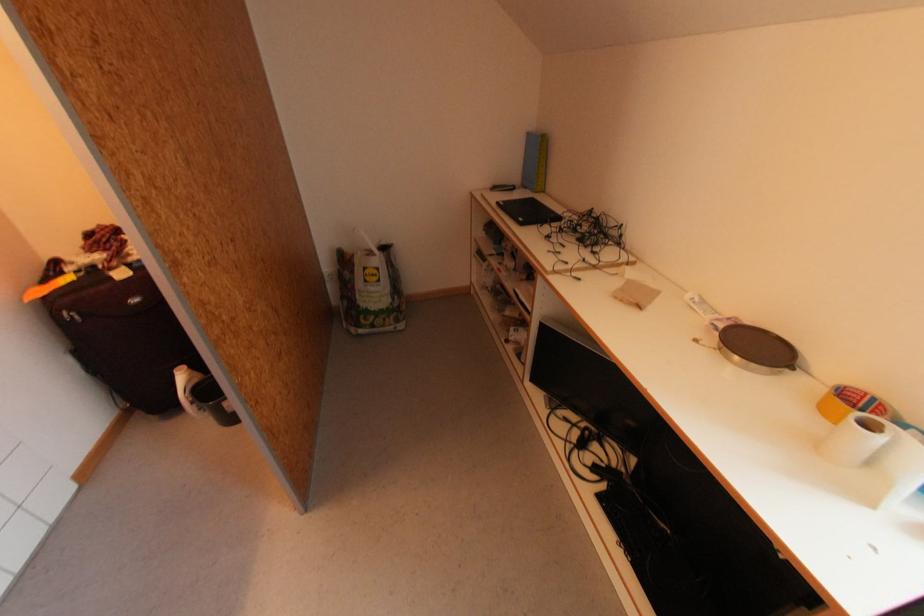
At what (x,y) coordinates should I click in order to perform the action: click on white bag handle. Please return your answer as a coordinate pair (x, y). Image resolution: width=924 pixels, height=616 pixels. Looking at the image, I should click on (374, 248).